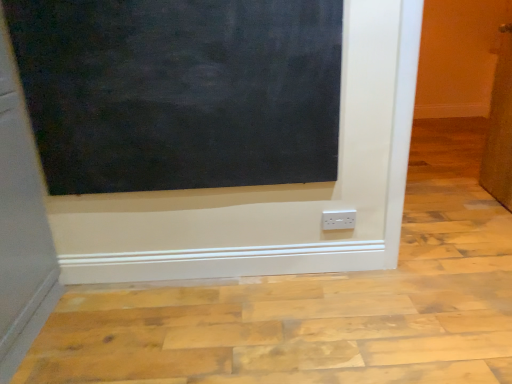
Question: From the image's perspective, is brown textured door at right on top of white plastic power plugs and sockets at lower center?

Choices:
 (A) yes
 (B) no

Answer: (A)

Question: Is brown textured door at right not within white plastic power plugs and sockets at lower center?

Choices:
 (A) yes
 (B) no

Answer: (A)

Question: Is brown textured door at right shorter than white plastic power plugs and sockets at lower center?

Choices:
 (A) yes
 (B) no

Answer: (B)

Question: Considering the relative positions of brown textured door at right and white plastic power plugs and sockets at lower center in the image provided, is brown textured door at right to the right of white plastic power plugs and sockets at lower center from the viewer's perspective?

Choices:
 (A) yes
 (B) no

Answer: (A)

Question: Is brown textured door at right oriented away from white plastic power plugs and sockets at lower center?

Choices:
 (A) no
 (B) yes

Answer: (A)

Question: Is white plastic power plugs and sockets at lower center located within brown textured door at right?

Choices:
 (A) yes
 (B) no

Answer: (B)

Question: Does black matte board at upper left have a larger size compared to white plastic power plugs and sockets at lower center?

Choices:
 (A) yes
 (B) no

Answer: (A)

Question: Is black matte board at upper left facing away from white plastic power plugs and sockets at lower center?

Choices:
 (A) no
 (B) yes

Answer: (A)

Question: Can you confirm if black matte board at upper left is shorter than white plastic power plugs and sockets at lower center?

Choices:
 (A) yes
 (B) no

Answer: (B)

Question: From the image's perspective, does black matte board at upper left appear lower than white plastic power plugs and sockets at lower center?

Choices:
 (A) no
 (B) yes

Answer: (A)

Question: Considering the relative sizes of black matte board at upper left and white plastic power plugs and sockets at lower center in the image provided, is black matte board at upper left thinner than white plastic power plugs and sockets at lower center?

Choices:
 (A) no
 (B) yes

Answer: (A)

Question: From a real-world perspective, is black matte board at upper left on white plastic power plugs and sockets at lower center?

Choices:
 (A) no
 (B) yes

Answer: (B)

Question: Is white plastic power plugs and sockets at lower center closer to camera compared to black matte board at upper left?

Choices:
 (A) yes
 (B) no

Answer: (B)